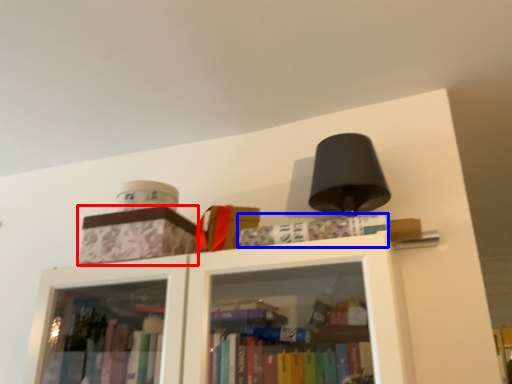
Question: Which object appears farthest to the camera in this image, cardboard box (highlighted by a red box) or book (highlighted by a blue box)?

Choices:
 (A) cardboard box
 (B) book

Answer: (A)